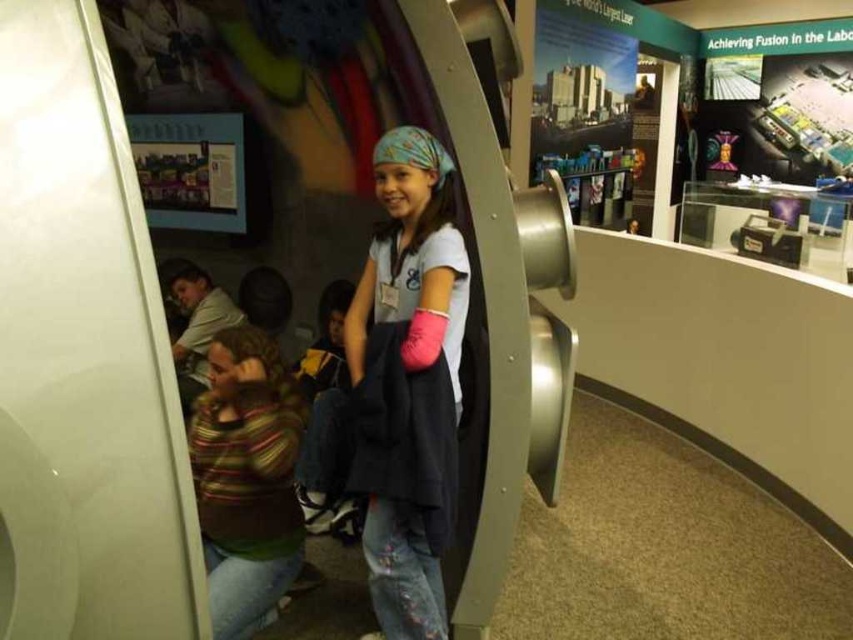
You are a tour guide at the museum and need to explain the seating arrangement to a visitor. Which of the two people, the white matte shirt at center or the striped sweater at lower left, is closer to the entrance of the exhibit?

The white matte shirt at center is closer to the entrance because it is in front of the striped sweater at lower left.

You are a tour guide in the museum and need to direct a visitor to the tallest person in the group. The visitor can see the white matte shirt at center and the striped sweater at lower left. Which one should they look at?

The white matte shirt at center is much taller than the striped sweater at lower left, so the visitor should look at the white matte shirt at center.